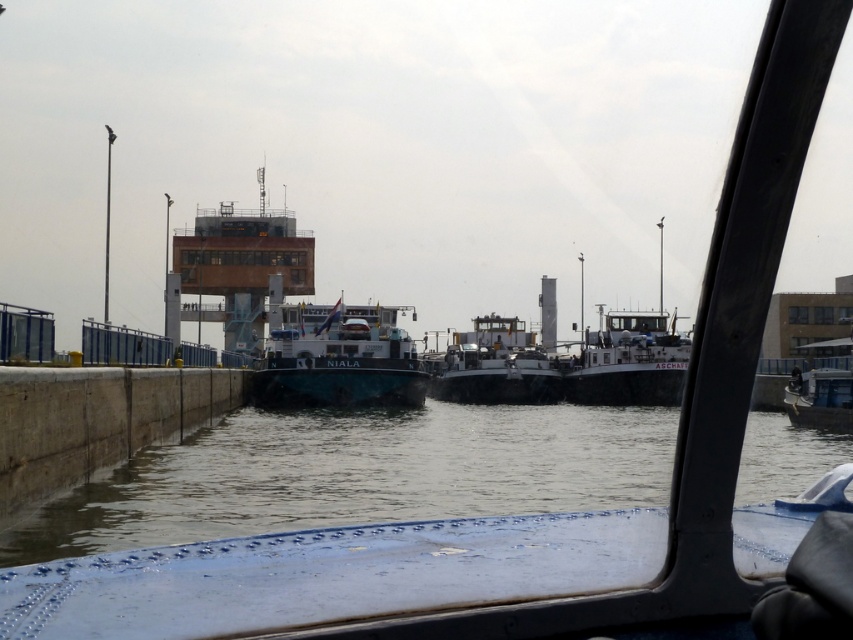
You are inside a boat and looking through the window. There is a point marked at coordinate (358, 474). What is located at that point?

The point at coordinate (358, 474) marks clear water at center.